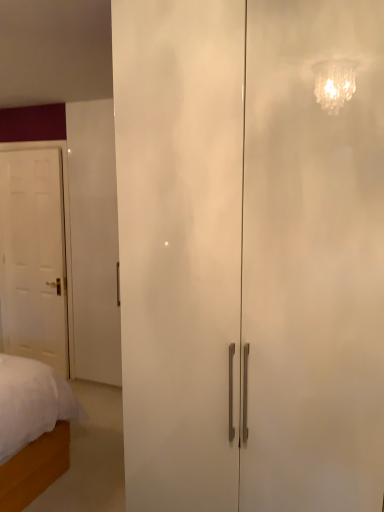
I want to click on free point above white matte door at left, marked as the 2th door in a front-to-back arrangement (from a real-world perspective), so click(x=27, y=150).